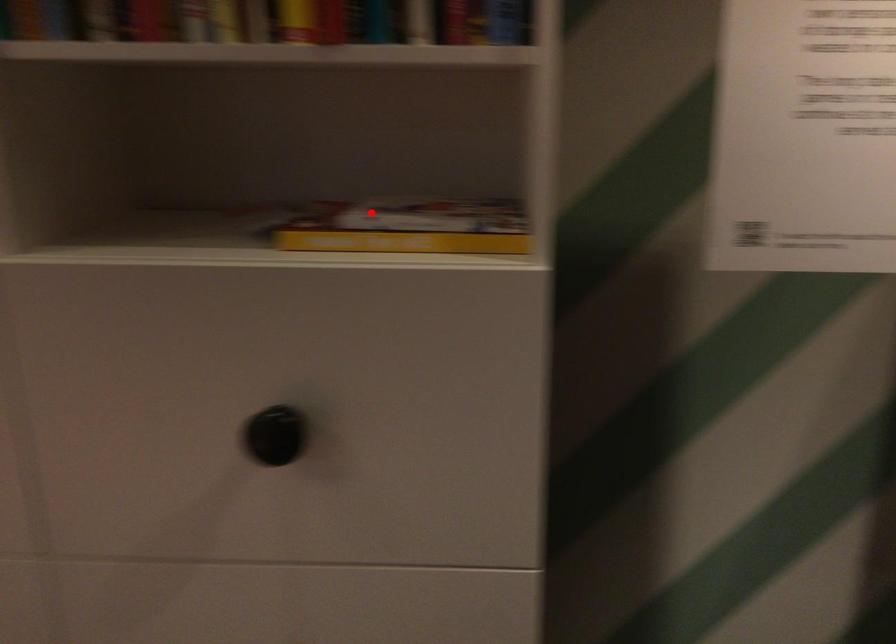
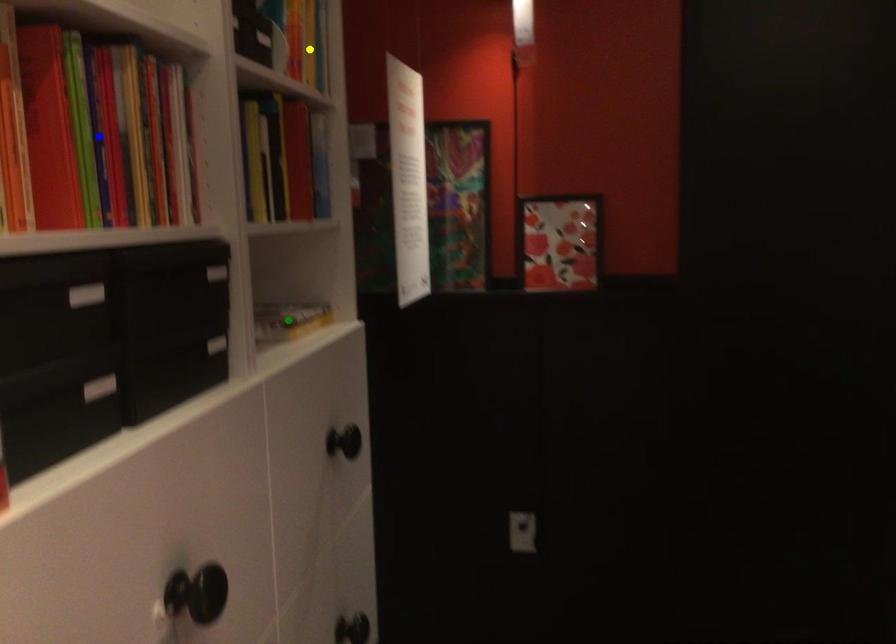
Question: I am providing you with two images of the same scene from different viewpoints. A red point is marked on the first image. You are given multiple points on the second image. Which point in image 2 represents the same 3d spot as the red point in image 1?

Choices:
 (A) blue point
 (B) green point
 (C) yellow point

Answer: (B)